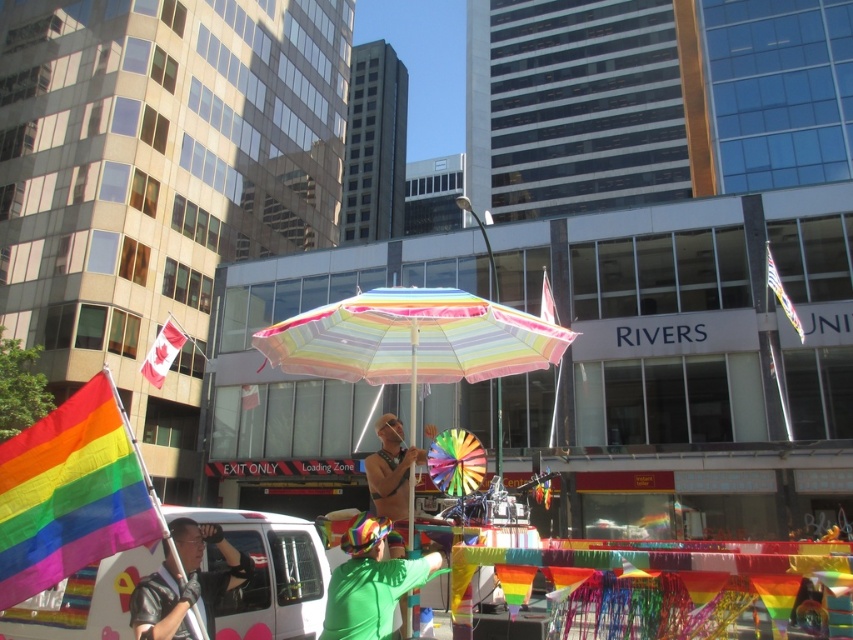
You are attending a parade and need to take a photo of both the green matte umbrella at center and the rainbow fabric flag at center. Which object should you adjust your camera angle to focus on first if you want to capture both in the same frame?

The green matte umbrella at center is positioned on the right side of the rainbow fabric flag at center. To capture both in the same frame, focus on the rainbow fabric flag at center first since it is on the left, then adjust the angle to include the green matte umbrella at center on the right.

You are a photographer at the event and want to capture both the rainbow fabric flag at lower left and the red fabric flag at upper left in a single shot. Which flag will appear smaller in the photo?

The rainbow fabric flag at lower left will appear smaller in the photo because it occupies less space than the red fabric flag at upper left.

You are a photographer standing in the middle of the street during a parade. You want to capture a photo that includes both the green matte umbrella at center and the rainbow fabric flag at center. Which object should you position closer to the front of your camera frame to ensure both are visible?

The green matte umbrella at center is closer to the viewer than the rainbow fabric flag at center, so you should position the green matte umbrella at center at the front of the camera frame to ensure both are visible.